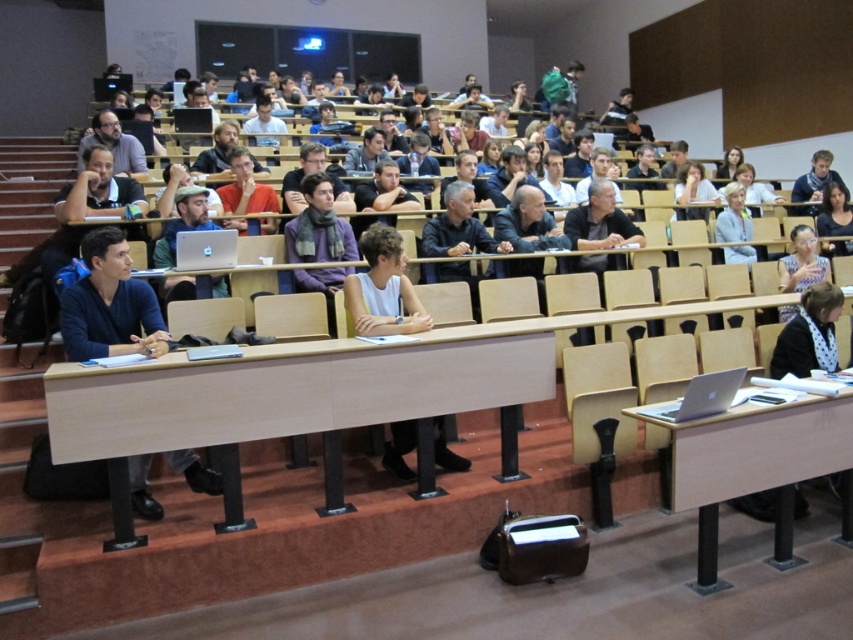
Question: Estimate the real-world distances between objects in this image. Which object is farther from the dark gray shirt at center?

Choices:
 (A) light wood table at center
 (B) light blue fabric jacket at upper right

Answer: (A)

Question: Is silver metallic table at lower right below light blue fabric jacket at upper right?

Choices:
 (A) yes
 (B) no

Answer: (A)

Question: Which point appears closest to the camera in this image?

Choices:
 (A) [x=792, y=211]
 (B) [x=843, y=232]
 (C) [x=96, y=264]

Answer: (C)

Question: Does light wood table at center appear on the left side of silver metallic table at lower right?

Choices:
 (A) yes
 (B) no

Answer: (A)

Question: Which object appears closest to the camera in this image?

Choices:
 (A) dark brown hair at upper right
 (B) blue scarf at upper right

Answer: (A)

Question: Does dark blue sweater at left have a lesser width compared to dark brown hair at upper right?

Choices:
 (A) no
 (B) yes

Answer: (B)